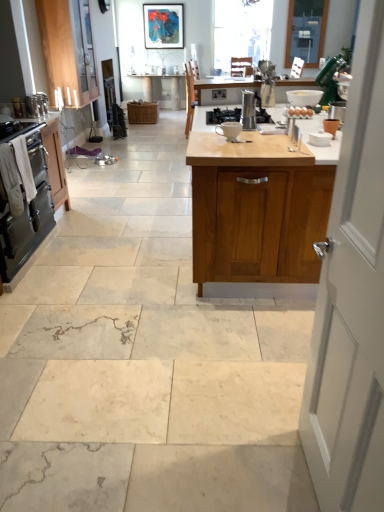
What do you see at coordinates (163, 26) in the screenshot?
I see `matte black picture frame at upper center` at bounding box center [163, 26].

This screenshot has width=384, height=512. What do you see at coordinates (55, 163) in the screenshot? I see `white towel oven at left, which is counted as the second cabinetry, starting from the right` at bounding box center [55, 163].

Measure the distance between point [217,131] and camera.

Point [217,131] is 2.95 meters away from camera.

What is the approximate height of white ceramic mug at center, which is counted as the third appliance, starting from the left?

white ceramic mug at center, which is counted as the third appliance, starting from the left, is 4.20 inches in height.

Where is `light wood cabinet at center, the first cabinetry positioned from the right`? The width and height of the screenshot is (384, 512). light wood cabinet at center, the first cabinetry positioned from the right is located at coordinates (263, 220).

The height and width of the screenshot is (512, 384). Identify the location of matte black picture frame at upper center. (163, 26).

From the image's perspective, is light wood cabinet at center, the 3th cabinetry when ordered from left to right, under black enamel oven at left?

Actually, light wood cabinet at center, the 3th cabinetry when ordered from left to right, appears above black enamel oven at left in the image.

Is light wood cabinet at center, the first cabinetry positioned from the right, at the right side of black enamel oven at left?

Indeed, light wood cabinet at center, the first cabinetry positioned from the right, is positioned on the right side of black enamel oven at left.

Which of these two, light wood cabinet at center, the first cabinetry positioned from the right, or black enamel oven at left, is bigger?

Bigger between the two is light wood cabinet at center, the first cabinetry positioned from the right.

Is light wood cabinet at center, the 3th cabinetry when ordered from left to right, beside black enamel oven at left?

light wood cabinet at center, the 3th cabinetry when ordered from left to right, and black enamel oven at left are clearly separated.

How different are the orientations of satin silver cabinet at center and matte black picture frame at upper center in degrees?

The angle between the facing direction of satin silver cabinet at center and the facing direction of matte black picture frame at upper center is 0.655 degrees.

You are a GUI agent. You are given a task and a screenshot of the screen. Output one action in this format:
    pyautogui.click(x=<x>, y=<y>)
    Task: Click on the vanity on the left of matte black picture frame at upper center
    The width and height of the screenshot is (384, 512).
    Given the screenshot: What is the action you would take?
    pyautogui.click(x=158, y=90)

Is the depth of satin silver cabinet at center less than that of matte black picture frame at upper center?

No.

In the scene shown: Is satin silver cabinet at center at the right side of matte black picture frame at upper center?

Incorrect, satin silver cabinet at center is not on the right side of matte black picture frame at upper center.

Is terracotta clay pot at upper right, which is the fifth appliance from left to right, placed right next to white wood door at right?

No, terracotta clay pot at upper right, which is the fifth appliance from left to right, is not next to white wood door at right.

Who is smaller, terracotta clay pot at upper right, the fourth appliance positioned from the back, or white wood door at right?

With smaller size is terracotta clay pot at upper right, the fourth appliance positioned from the back.

Does terracotta clay pot at upper right, the fourth appliance positioned from the back, have a lesser height compared to white wood door at right?

Yes.

Is white wood door at right inside terracotta clay pot at upper right, which is the fifth appliance from left to right?

That's incorrect, white wood door at right is not inside terracotta clay pot at upper right, which is the fifth appliance from left to right.

In the scene shown: In the image, is black enamel oven at left positioned in front of or behind white towel oven at left, the 2th cabinetry when ordered from left to right?

In the image, black enamel oven at left appears in front of white towel oven at left, the 2th cabinetry when ordered from left to right.

From a real-world perspective, is black enamel oven at left positioned above or below white towel oven at left, which is counted as the second cabinetry, starting from the right?

From a real-world perspective, black enamel oven at left is physically above white towel oven at left, which is counted as the second cabinetry, starting from the right.

From the image's perspective, which is below, black enamel oven at left or white towel oven at left, the 2th cabinetry when ordered from left to right?

black enamel oven at left.

Is black enamel oven at left wider or thinner than white towel oven at left, the 2th cabinetry when ordered from left to right?

black enamel oven at left is wider than white towel oven at left, the 2th cabinetry when ordered from left to right.

Considering the relative sizes of white wood door at right and wooden cabinet at upper left, which ranks as the first cabinetry in left-to-right order, in the image provided, is white wood door at right smaller than wooden cabinet at upper left, which ranks as the first cabinetry in left-to-right order,?

Yes, white wood door at right is smaller than wooden cabinet at upper left, which ranks as the first cabinetry in left-to-right order.

Which of these two, white wood door at right or wooden cabinet at upper left, which ranks as the first cabinetry in left-to-right order, stands taller?

With more height is white wood door at right.

From a real-world perspective, relative to wooden cabinet at upper left, the 3th cabinetry when ordered from right to left, is white wood door at right vertically above or below?

white wood door at right is situated lower than wooden cabinet at upper left, the 3th cabinetry when ordered from right to left, in the real world.

Does point (372, 505) come in front of point (54, 61)?

Yes, point (372, 505) is closer to viewer.

From a real-world perspective, does light wood cabinet at center, the 3th cabinetry when ordered from left to right, sit lower than wooden cabinet at upper left, which ranks as the first cabinetry in left-to-right order?

Yes, from a real-world perspective, light wood cabinet at center, the 3th cabinetry when ordered from left to right, is beneath wooden cabinet at upper left, which ranks as the first cabinetry in left-to-right order.

Consider the image. How distant is light wood cabinet at center, the 3th cabinetry when ordered from left to right, from wooden cabinet at upper left, which ranks as the first cabinetry in left-to-right order?

A distance of 14.12 feet exists between light wood cabinet at center, the 3th cabinetry when ordered from left to right, and wooden cabinet at upper left, which ranks as the first cabinetry in left-to-right order.

Is light wood cabinet at center, the first cabinetry positioned from the right, behind wooden cabinet at upper left, the 3th cabinetry when ordered from right to left?

That is False.

Considering the points (293, 261) and (66, 6), which point is in front, point (293, 261) or point (66, 6)?

The point (293, 261) is more forward.

In the scene shown: Does terracotta clay pot at upper right, the second appliance positioned from the front, appear on the left side of white ceramic mug at center, the first appliance in the front-to-back sequence?

Incorrect, terracotta clay pot at upper right, the second appliance positioned from the front, is not on the left side of white ceramic mug at center, the first appliance in the front-to-back sequence.

Can white ceramic mug at center, which is counted as the third appliance, starting from the left, be found inside terracotta clay pot at upper right, the fourth appliance positioned from the back?

That's incorrect, white ceramic mug at center, which is counted as the third appliance, starting from the left, is not inside terracotta clay pot at upper right, the fourth appliance positioned from the back.

Is terracotta clay pot at upper right, the second appliance positioned from the front, smaller than white ceramic mug at center, which is counted as the third appliance, starting from the left?

Yes, terracotta clay pot at upper right, the second appliance positioned from the front, is smaller than white ceramic mug at center, which is counted as the third appliance, starting from the left.

Does terracotta clay pot at upper right, which is the fifth appliance from left to right, lie in front of white ceramic mug at center, which is counted as the third appliance, starting from the left?

No, it is not.

At what (x,y) coordinates should I click in order to perform the action: click on kitchen appliance behind the light wood cabinet at center, the 3th cabinetry when ordered from left to right. Please return your answer as a coordinate pair (x, y). Looking at the image, I should click on (27, 211).

Where is `picture frame above the satin silver cabinet at center (from the image's perspective)`? picture frame above the satin silver cabinet at center (from the image's perspective) is located at coordinates (163, 26).

Based on their spatial positions, is metallic silver coffee maker at center, which appears as the 3th appliance when viewed from the front, or clear glass window at upper center closer to satin silver cabinet at center?

clear glass window at upper center is positioned closer to the anchor satin silver cabinet at center.

Estimate the real-world distances between objects in this image. Which object is closer to metallic silver coffee maker at center, which is the third appliance in back-to-front order, brown matte eggs at center or metallic silver coffee machine at left, marked as the 2th appliance in a left-to-right arrangement?

The object closer to metallic silver coffee maker at center, which is the third appliance in back-to-front order, is brown matte eggs at center.

Looking at this image, looking at the image, which one is located closer to light wood cabinet at center, the 3th cabinetry when ordered from left to right, brown matte eggs at center or metallic silver kettle at left, which appears as the fifth appliance when viewed from the right?

The object closer to light wood cabinet at center, the 3th cabinetry when ordered from left to right, is brown matte eggs at center.

Looking at the image, which one is located further to matte black picture frame at upper center, white ceramic mug at center, the first appliance in the front-to-back sequence, or satin silver cabinet at center?

white ceramic mug at center, the first appliance in the front-to-back sequence, is positioned further to the anchor matte black picture frame at upper center.

Estimate the real-world distances between objects in this image. Which object is closer to matte black picture frame at upper center, clear glass window at upper center or wooden cabinet at upper left, the 3th cabinetry when ordered from right to left?

wooden cabinet at upper left, the 3th cabinetry when ordered from right to left, is closer to matte black picture frame at upper center.

Which object lies further to the anchor point black matte gas stove at center, satin silver cabinet at center or metallic silver coffee maker at center, which appears as the 3th appliance when viewed from the front?

satin silver cabinet at center lies further to black matte gas stove at center than the other object.

Considering their positions, is wooden cabinet at upper left, the 3th cabinetry when ordered from right to left, positioned further to brown matte eggs at center than matte black picture frame at upper center?

The object further to brown matte eggs at center is matte black picture frame at upper center.

Based on their spatial positions, is white towel oven at left, the 2th cabinetry when ordered from left to right, or black enamel oven at left further from metallic silver coffee machine at left, marked as the 2th appliance in a left-to-right arrangement?

Among the two, black enamel oven at left is located further to metallic silver coffee machine at left, marked as the 2th appliance in a left-to-right arrangement.

You are a GUI agent. You are given a task and a screenshot of the screen. Output one action in this format:
    pyautogui.click(x=<x>, y=<y>)
    Task: Click on the cabinetry between metallic silver coffee machine at left, the 5th appliance when ordered from front to back, and terracotta clay pot at upper right, the fourth appliance positioned from the back, from left to right
    
    Given the screenshot: What is the action you would take?
    pyautogui.click(x=263, y=220)

Image resolution: width=384 pixels, height=512 pixels. I want to click on food between black enamel oven at left and satin silver cabinet at center in the front-back direction, so click(300, 112).

Find the location of a particular element. The image size is (384, 512). appliance located between black matte gas stove at center and terracotta clay pot at upper right, the second appliance positioned from the front, in the left-right direction is located at coordinates (248, 110).

Where is `door located between black enamel oven at left and light wood cabinet at center, the first cabinetry positioned from the right, in the left-right direction`? door located between black enamel oven at left and light wood cabinet at center, the first cabinetry positioned from the right, in the left-right direction is located at coordinates (352, 301).